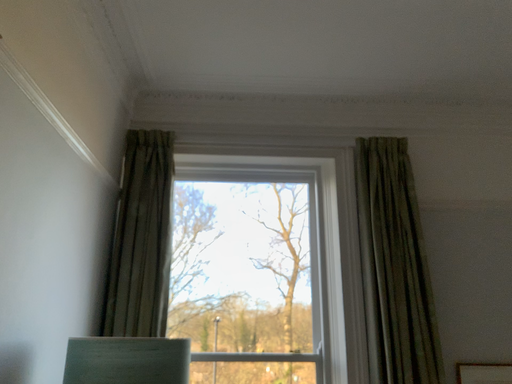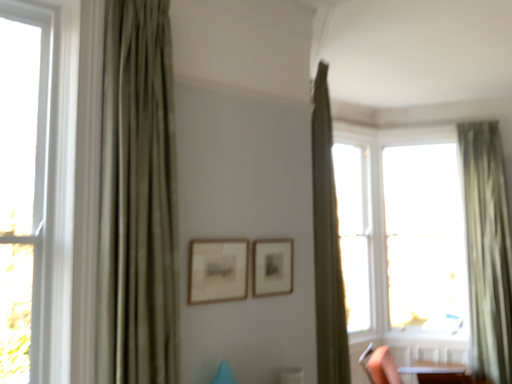
Question: How did the camera likely rotate when shooting the video?

Choices:
 (A) rotated upward
 (B) rotated downward

Answer: (B)